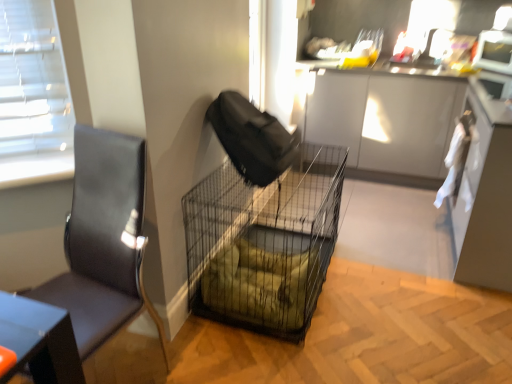
Question: From a real-world perspective, relative to metal mesh crate at center, is black wire mesh cage at center vertically above or below?

Choices:
 (A) above
 (B) below

Answer: (A)

Question: Is black wire mesh cage at center bigger or smaller than metal mesh crate at center?

Choices:
 (A) big
 (B) small

Answer: (A)

Question: Estimate the real-world distances between objects in this image. Which object is closer to the metal mesh crate at center?

Choices:
 (A) white glossy microwave at upper right
 (B) black wire mesh cage at center
 (C) white cloth at right
 (D) black leather chair at left

Answer: (A)

Question: Estimate the real-world distances between objects in this image. Which object is closer to the metal mesh crate at center?

Choices:
 (A) black leather chair at left
 (B) black wire mesh cage at center
 (C) white cloth at right
 (D) white glossy microwave at upper right

Answer: (D)